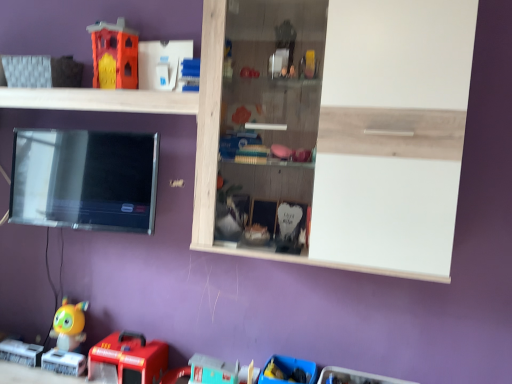
Question: Is blue plastic toy at lower center, the first toy in the bottom-to-top sequence, aimed at rubberized red fire truck at lower left, the 3th toy when ordered from top to bottom?

Choices:
 (A) no
 (B) yes

Answer: (A)

Question: From a real-world perspective, is blue plastic toy at lower center, the fourth toy positioned from the left, located higher than rubberized red fire truck at lower left, marked as the second toy in a bottom-to-top arrangement?

Choices:
 (A) yes
 (B) no

Answer: (A)

Question: Is blue plastic toy at lower center, which ranks as the 1th toy in right-to-left order, positioned behind rubberized red fire truck at lower left, the 3th toy when ordered from top to bottom?

Choices:
 (A) no
 (B) yes

Answer: (A)

Question: Can you confirm if blue plastic toy at lower center, the first toy in the bottom-to-top sequence, is positioned to the right of rubberized red fire truck at lower left, the second toy from the right?

Choices:
 (A) yes
 (B) no

Answer: (A)

Question: Is blue plastic toy at lower center, the fourth toy positioned from the left, closer to the viewer compared to rubberized red fire truck at lower left, marked as the second toy in a bottom-to-top arrangement?

Choices:
 (A) no
 (B) yes

Answer: (B)

Question: Does blue plastic toy at lower center, placed as the 4th toy when sorted from top to bottom, have a lesser height compared to rubberized red fire truck at lower left, the 3th toy when ordered from top to bottom?

Choices:
 (A) yes
 (B) no

Answer: (A)

Question: Can you confirm if yellow matte toy at lower left, which is the fourth toy in right-to-left order, is smaller than wooden cabinet at upper center, positioned as the first shelf in right-to-left order?

Choices:
 (A) yes
 (B) no

Answer: (A)

Question: Does yellow matte toy at lower left, the 2th toy from the top, have a larger size compared to wooden cabinet at upper center, positioned as the 2th shelf in left-to-right order?

Choices:
 (A) no
 (B) yes

Answer: (A)

Question: Does yellow matte toy at lower left, the 2th toy from the top, have a greater height compared to wooden cabinet at upper center, positioned as the first shelf in right-to-left order?

Choices:
 (A) yes
 (B) no

Answer: (B)

Question: Is yellow matte toy at lower left, which appears as the third toy when ordered from the bottom, facing away from wooden cabinet at upper center, positioned as the first shelf in right-to-left order?

Choices:
 (A) yes
 (B) no

Answer: (B)

Question: Would you say yellow matte toy at lower left, which appears as the third toy when ordered from the bottom, contains wooden cabinet at upper center, positioned as the first shelf in right-to-left order?

Choices:
 (A) no
 (B) yes

Answer: (A)

Question: Is yellow matte toy at lower left, which is the fourth toy in right-to-left order, closer to camera compared to wooden cabinet at upper center, positioned as the first shelf in right-to-left order?

Choices:
 (A) yes
 (B) no

Answer: (B)

Question: Is rubberized red fire truck at lower left, marked as the second toy in a bottom-to-top arrangement, positioned with its back to white wood shelf at upper center, arranged as the first shelf when viewed from the left?

Choices:
 (A) no
 (B) yes

Answer: (A)